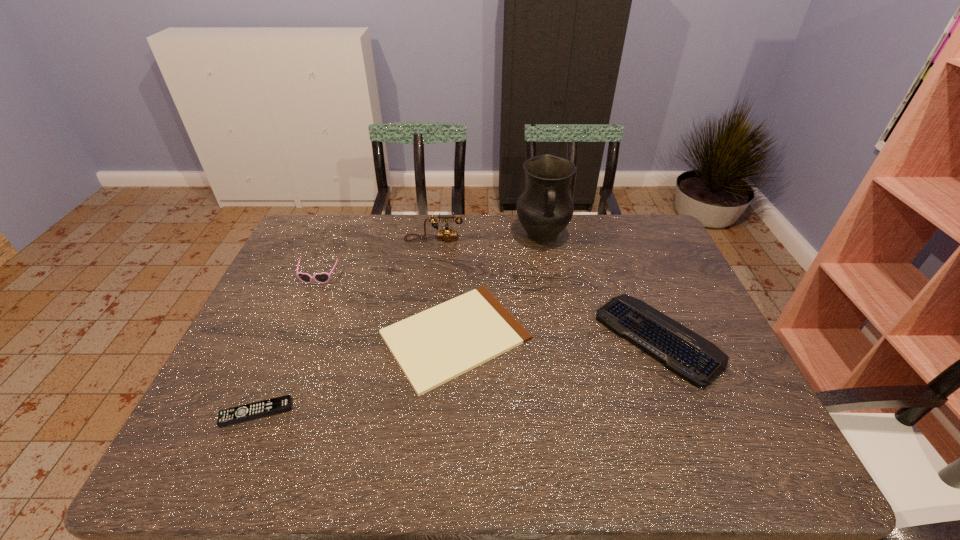
Find the location of a particular element. Image resolution: width=960 pixels, height=540 pixels. vacant region between the rightmost object and the clipboard is located at coordinates (557, 337).

You are a GUI agent. You are given a task and a screenshot of the screen. Output one action in this format:
    pyautogui.click(x=<x>, y=<y>)
    Task: Click on the free space between the tallest object and the third shortest object
    This screenshot has width=960, height=540.
    Given the screenshot: What is the action you would take?
    tap(600, 287)

The width and height of the screenshot is (960, 540). Find the location of `free space that is in between the third tallest object and the nearest object`. free space that is in between the third tallest object and the nearest object is located at coordinates (287, 345).

Where is `object that stands as the fifth closest to the remote control`? This screenshot has width=960, height=540. object that stands as the fifth closest to the remote control is located at coordinates (545, 208).

Identify which object is the fifth closest to the sunglasses. Please provide its 2D coordinates. Your answer should be formatted as a tuple, i.e. [(x, y)], where the tuple contains the x and y coordinates of a point satisfying the conditions above.

[(685, 353)]

At what (x,y) coordinates should I click in order to perform the action: click on free space that satisfies the following two spatial constraints: 1. on the front-facing side of the third tallest object; 2. on the right side of the clipboard. Please return your answer as a coordinate pair (x, y). Looking at the image, I should click on pos(294,336).

Locate an element on the screen. The width and height of the screenshot is (960, 540). vacant space that satisfies the following two spatial constraints: 1. on the back side of the rightmost object; 2. on the left side of the remote control is located at coordinates (288, 338).

I want to click on free space that satisfies the following two spatial constraints: 1. on the front-facing side of the sunglasses; 2. on the right side of the clipboard, so click(294, 336).

Locate an element on the screen. vacant region that satisfies the following two spatial constraints: 1. on the front-facing side of the third farthest object; 2. on the right side of the computer keyboard is located at coordinates (293, 338).